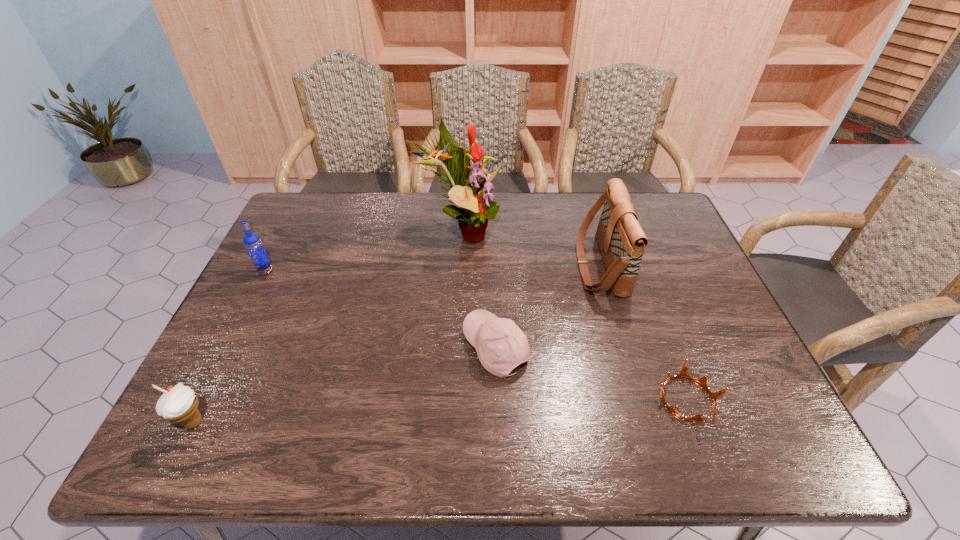
This screenshot has height=540, width=960. Find the location of `bouquet`. bouquet is located at coordinates (477, 206).

Find the location of a particular element. shoulder bag is located at coordinates (622, 242).

Locate an element on the screen. The height and width of the screenshot is (540, 960). vodka is located at coordinates (252, 242).

At what (x,y) coordinates should I click in order to perform the action: click on the fourth tallest object. Please return your answer as a coordinate pair (x, y). The width and height of the screenshot is (960, 540). Looking at the image, I should click on (180, 403).

Locate an element on the screen. This screenshot has width=960, height=540. the fifth tallest object is located at coordinates (501, 345).

The image size is (960, 540). I want to click on crown, so tap(683, 374).

Find the location of a particular element. The image size is (960, 540). vacant position located on the front-facing side of the tallest object is located at coordinates (625, 232).

The image size is (960, 540). Find the location of `free space located 0.380m on the front-facing side of the shoulder bag`. free space located 0.380m on the front-facing side of the shoulder bag is located at coordinates (448, 266).

Where is `vacant space located on the front-facing side of the shoulder bag`? The height and width of the screenshot is (540, 960). vacant space located on the front-facing side of the shoulder bag is located at coordinates (543, 266).

You are a GUI agent. You are given a task and a screenshot of the screen. Output one action in this format:
    pyautogui.click(x=<x>, y=<y>)
    Task: Click on the vacant space located on the front-facing side of the shoulder bag
    The height and width of the screenshot is (540, 960).
    Given the screenshot: What is the action you would take?
    pyautogui.click(x=475, y=266)